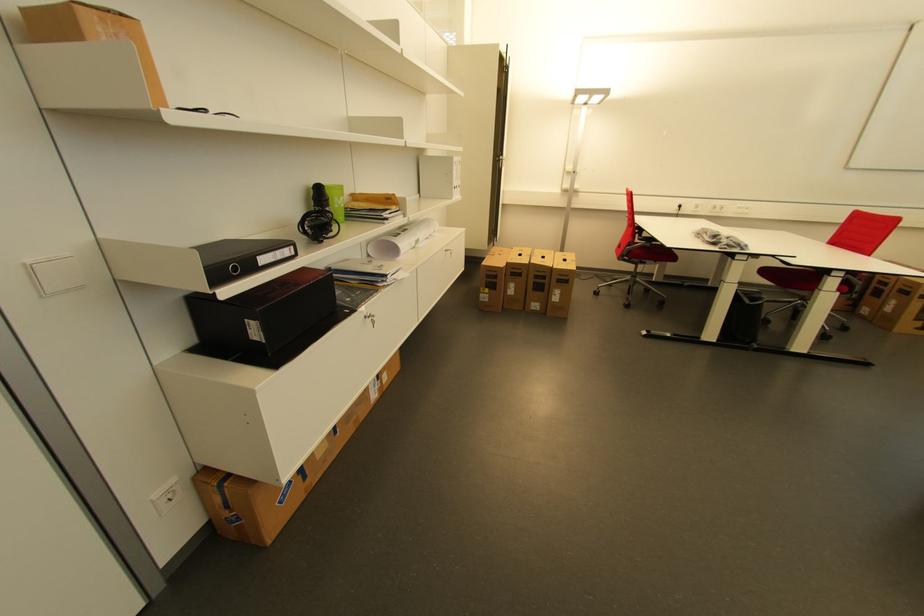
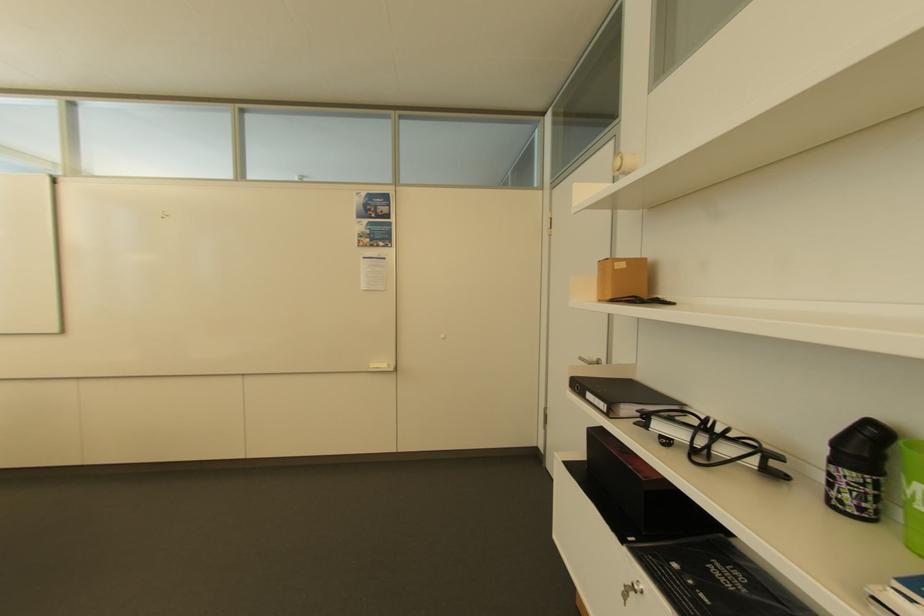
Where in the second image is the point corresponding to (x=263, y=257) from the first image?

(592, 392)